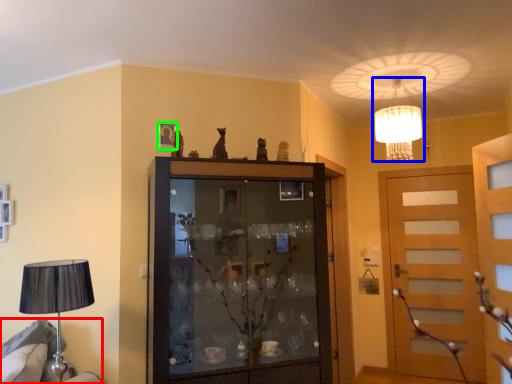
Question: Based on their relative distances, which object is farther from furniture (highlighted by a red box)? Choose from lamp (highlighted by a blue box) and picture frame (highlighted by a green box).

Choices:
 (A) lamp
 (B) picture frame

Answer: (A)